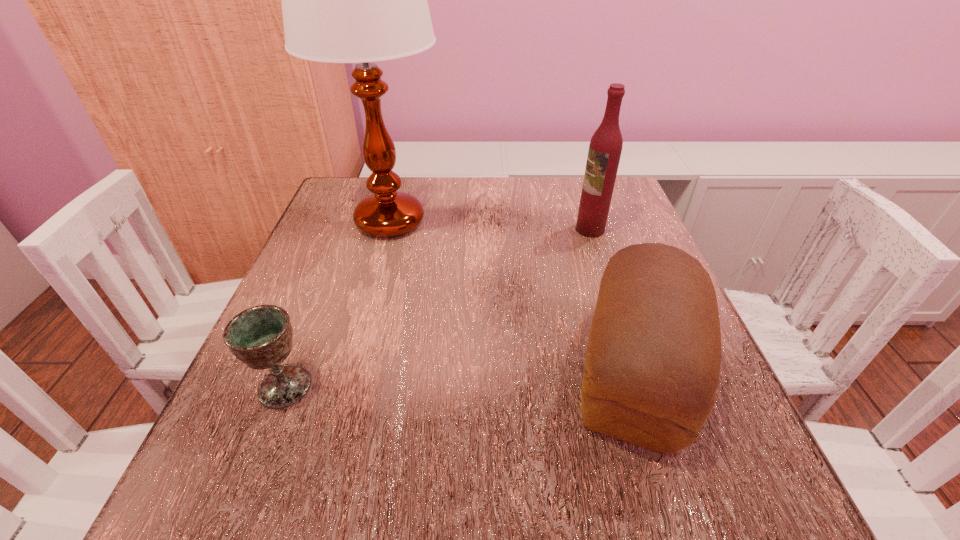
Identify the location of table lamp located at the far edge. (360, 0).

Locate an element on the screen. liquor at the far edge is located at coordinates (605, 148).

Identify the location of object located in the near edge section of the desktop. The height and width of the screenshot is (540, 960). (653, 359).

I want to click on table lamp present at the left edge, so click(360, 0).

This screenshot has width=960, height=540. In order to click on chalice located in the left edge section of the desktop in this screenshot , I will do `click(261, 337)`.

The width and height of the screenshot is (960, 540). I want to click on liquor situated at the right edge, so click(x=605, y=148).

Locate an element on the screen. This screenshot has height=540, width=960. bread situated at the right edge is located at coordinates (653, 359).

The width and height of the screenshot is (960, 540). I want to click on object that is at the far left corner, so click(x=360, y=0).

I want to click on object at the far right corner, so click(x=605, y=148).

Locate an element on the screen. The width and height of the screenshot is (960, 540). object located at the near right corner is located at coordinates (653, 359).